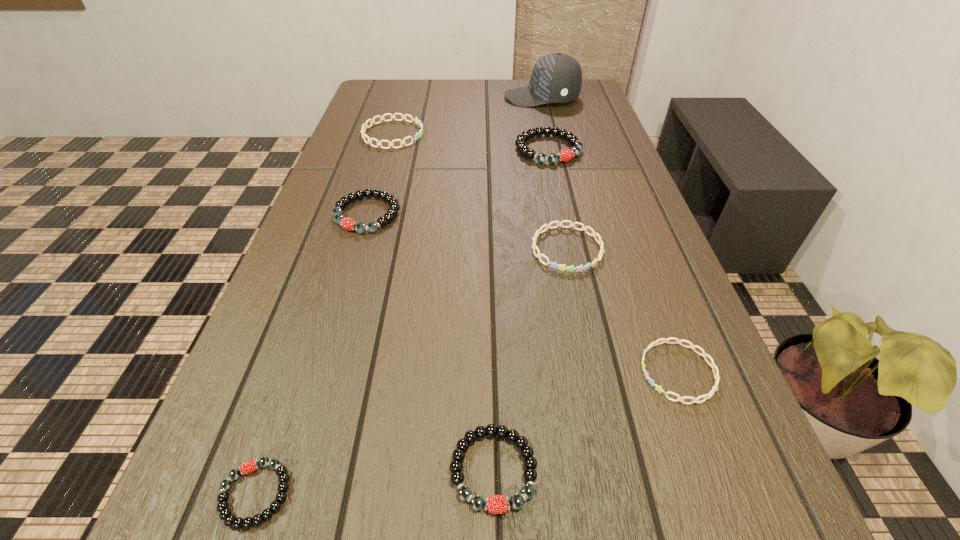
The height and width of the screenshot is (540, 960). I want to click on the second smallest black bracelet, so click(x=497, y=504).

This screenshot has height=540, width=960. What are the coordinates of `the rightmost blue bracelet` in the screenshot? It's located at (716, 375).

The height and width of the screenshot is (540, 960). I want to click on the third nearest bracelet, so click(x=716, y=375).

Locate an element on the screen. The image size is (960, 540). the smallest black bracelet is located at coordinates tap(225, 514).

Identify the location of free space located 0.080m at the front of the tallest object where the brim is located. This screenshot has width=960, height=540. (480, 98).

You are a GUI agent. You are given a task and a screenshot of the screen. Output one action in this format:
    pyautogui.click(x=<x>, y=<y>)
    Task: Click on the vacant position located at the front of the tallest object where the brim is located
    The height and width of the screenshot is (540, 960).
    Given the screenshot: What is the action you would take?
    pyautogui.click(x=393, y=98)

The image size is (960, 540). I want to click on vacant region located 0.160m at the front of the tallest object where the brim is located, so click(x=456, y=98).

Identify the location of vacant space situated on the back of the biggest black bracelet. The image size is (960, 540). (538, 98).

At what (x,y) coordinates should I click in order to perform the action: click on vacant space located 0.310m on the surface of the farthest blue bracelet showing star-shaped elements. Please return your answer as a coordinate pair (x, y). Image resolution: width=960 pixels, height=540 pixels. Looking at the image, I should click on (530, 134).

Locate an element on the screen. This screenshot has height=540, width=960. vacant position located 0.170m on the back of the second farthest black bracelet is located at coordinates (384, 159).